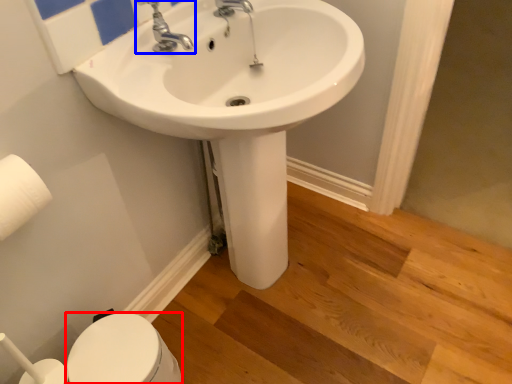
Question: Which object appears farthest to the camera in this image, bidet (highlighted by a red box) or tap (highlighted by a blue box)?

Choices:
 (A) bidet
 (B) tap

Answer: (A)